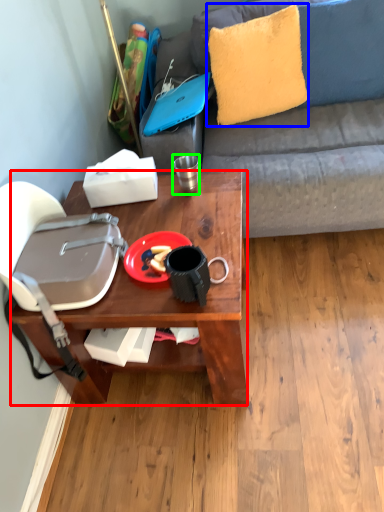
Question: Which object is the farthest from desk (highlighted by a red box)? Choose among these: pillow (highlighted by a blue box) or coffee cup (highlighted by a green box).

Choices:
 (A) pillow
 (B) coffee cup

Answer: (A)